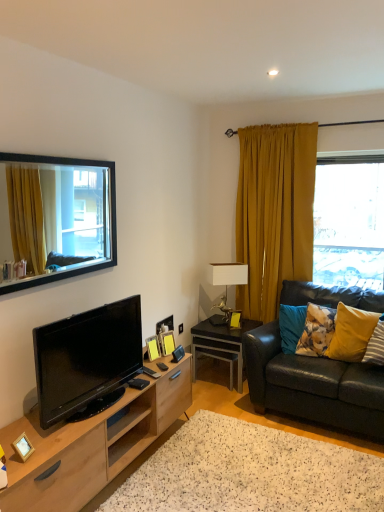
Question: Which direction should I rotate to face wooden picture frame at center, positioned as the third picture frame in front-to-back order, — up or down?

Choices:
 (A) down
 (B) up

Answer: (A)

Question: From a real-world perspective, is black-framed mirror at upper left, marked as the second window in a right-to-left arrangement, on yellow velvet pillow at right, the 3th pillow when ordered from left to right?

Choices:
 (A) no
 (B) yes

Answer: (B)

Question: Is black-framed mirror at upper left, marked as the second window in a right-to-left arrangement, surrounding yellow velvet pillow at right, the 1th pillow in the right-to-left sequence?

Choices:
 (A) no
 (B) yes

Answer: (A)

Question: Considering the relative sizes of black-framed mirror at upper left, marked as the second window in a right-to-left arrangement, and yellow velvet pillow at right, the 3th pillow when ordered from left to right, in the image provided, is black-framed mirror at upper left, marked as the second window in a right-to-left arrangement, smaller than yellow velvet pillow at right, the 3th pillow when ordered from left to right,?

Choices:
 (A) no
 (B) yes

Answer: (A)

Question: Is black-framed mirror at upper left, which is the 1th window in front-to-back order, wider than yellow velvet pillow at right, the 3th pillow when ordered from left to right?

Choices:
 (A) yes
 (B) no

Answer: (B)

Question: Can you confirm if black-framed mirror at upper left, marked as the second window in a right-to-left arrangement, is thinner than yellow velvet pillow at right, the 3th pillow when ordered from left to right?

Choices:
 (A) no
 (B) yes

Answer: (B)

Question: Is black-framed mirror at upper left, which is counted as the second window, starting from the back, taller than yellow velvet pillow at right, the 3th pillow when ordered from left to right?

Choices:
 (A) yes
 (B) no

Answer: (A)

Question: Does yellow fabric pillow at right, which is counted as the second pillow, starting from the right, have a lesser height compared to yellow velvet pillow at right, the 1th pillow in the right-to-left sequence?

Choices:
 (A) no
 (B) yes

Answer: (A)

Question: Is yellow fabric pillow at right, which is counted as the second pillow, starting from the right, far away from yellow velvet pillow at right, the 3th pillow when ordered from left to right?

Choices:
 (A) yes
 (B) no

Answer: (B)

Question: From a real-world perspective, is yellow fabric pillow at right, arranged as the second pillow when viewed from the left, located beneath yellow velvet pillow at right, the 1th pillow in the right-to-left sequence?

Choices:
 (A) yes
 (B) no

Answer: (B)

Question: Does yellow fabric pillow at right, arranged as the second pillow when viewed from the left, have a smaller size compared to yellow velvet pillow at right, the 1th pillow in the right-to-left sequence?

Choices:
 (A) yes
 (B) no

Answer: (B)

Question: Does yellow fabric pillow at right, arranged as the second pillow when viewed from the left, have a lesser width compared to yellow velvet pillow at right, the 3th pillow when ordered from left to right?

Choices:
 (A) yes
 (B) no

Answer: (A)

Question: Considering the relative sizes of yellow fabric pillow at right, arranged as the second pillow when viewed from the left, and yellow velvet pillow at right, the 3th pillow when ordered from left to right, in the image provided, is yellow fabric pillow at right, arranged as the second pillow when viewed from the left, wider than yellow velvet pillow at right, the 3th pillow when ordered from left to right,?

Choices:
 (A) yes
 (B) no

Answer: (B)

Question: Is black glossy tv at lower left oriented towards black glossy side table at lower right?

Choices:
 (A) no
 (B) yes

Answer: (A)